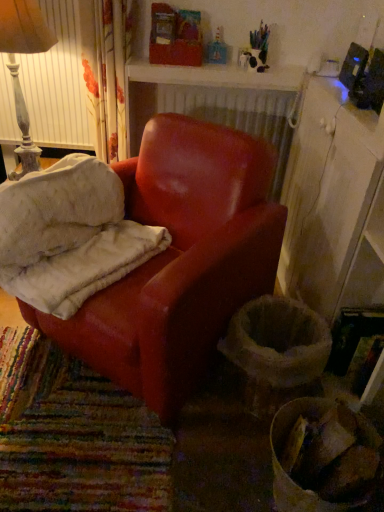
Describe the element at coordinates (18, 65) in the screenshot. I see `distressed white lampshade at upper left` at that location.

Describe the element at coordinates (69, 234) in the screenshot. Image resolution: width=384 pixels, height=512 pixels. I see `leather armchair at center` at that location.

Measure the distance between matte red armchair at center and camera.

matte red armchair at center is 1.10 meters away from camera.

Find the location of a particular element. white wood cabinet at right is located at coordinates (327, 193).

What do you see at coordinates (327, 193) in the screenshot?
I see `white wood cabinet at right` at bounding box center [327, 193].

Identify the location of distressed white lampshade at upper left. 18,65.

From a real-world perspective, which is physically below, white wood cabinet at right or matte red armchair at center?

In real-world perspective, matte red armchair at center is lower.

In the image, is white wood cabinet at right on the left side or the right side of matte red armchair at center?

In the image, white wood cabinet at right appears on the right side of matte red armchair at center.

Which object is wider, white wood cabinet at right or matte red armchair at center?

matte red armchair at center.

From the image's perspective, who appears lower, matte red armchair at center or distressed white lampshade at upper left?

matte red armchair at center is shown below in the image.

Where is `lamp on the left of matte red armchair at center`? lamp on the left of matte red armchair at center is located at coordinates (18, 65).

Which is less distant, (x=221, y=199) or (x=32, y=159)?

Positioned in front is point (x=221, y=199).

Is matte red armchair at center facing away from distressed white lampshade at upper left?

No, matte red armchair at center is not facing the opposite direction of distressed white lampshade at upper left.

You are a GUI agent. You are given a task and a screenshot of the screen. Output one action in this format:
    pyautogui.click(x=<x>, y=<y>)
    Task: Click on the cabinetry below the leather armchair at center (from a real-world perspective)
    This screenshot has width=384, height=512.
    Given the screenshot: What is the action you would take?
    pyautogui.click(x=327, y=193)

Is white wood cabinet at right further to the viewer compared to leather armchair at center?

Yes, it is behind leather armchair at center.

Can you tell me how much white wood cabinet at right and leather armchair at center differ in facing direction?

The angular difference between white wood cabinet at right and leather armchair at center is 50.6 degrees.

Measure the distance from white wood cabinet at right to leather armchair at center.

white wood cabinet at right and leather armchair at center are 31.16 inches apart from each other.

Based on the photo, is leather armchair at center further to the viewer compared to white textured radiator at upper center?

That is False.

From a real-world perspective, relative to white textured radiator at upper center, is leather armchair at center vertically above or below?

In terms of real-world spatial position, leather armchair at center is below white textured radiator at upper center.

Measure the distance between leather armchair at center and white textured radiator at upper center.

leather armchair at center and white textured radiator at upper center are 34.62 inches apart.

Between leather armchair at center and white textured radiator at upper center, which one has more height?

leather armchair at center is taller.

From the image's perspective, is white textured radiator at upper center located above white wood cabinet at right?

Yes, from the image's perspective, white textured radiator at upper center is on top of white wood cabinet at right.

Considering the relative positions of white textured radiator at upper center and white wood cabinet at right in the image provided, is white textured radiator at upper center to the left or to the right of white wood cabinet at right?

From the image, it's evident that white textured radiator at upper center is to the left of white wood cabinet at right.

From a real-world perspective, between white textured radiator at upper center and white wood cabinet at right, who is vertically lower?

white wood cabinet at right.

Can you confirm if distressed white lampshade at upper left is positioned to the left of white textured radiator at upper center?

Indeed, distressed white lampshade at upper left is positioned on the left side of white textured radiator at upper center.

From a real-world perspective, which object rests below the other?

white textured radiator at upper center, from a real-world perspective.

Does point (18, 109) come closer to viewer compared to point (284, 115)?

No, it is behind (284, 115).

Considering the relative positions of white textured radiator at upper center and matte red armchair at center in the image provided, is white textured radiator at upper center to the left or to the right of matte red armchair at center?

From the image, it's evident that white textured radiator at upper center is to the right of matte red armchair at center.

Considering the sizes of objects white textured radiator at upper center and matte red armchair at center in the image provided, who is bigger, white textured radiator at upper center or matte red armchair at center?

Bigger between the two is matte red armchair at center.

Between point (261, 106) and point (191, 170), which one is positioned in front?

Point (191, 170)

From a real-world perspective, who is located lower, white textured radiator at upper center or matte red armchair at center?

matte red armchair at center.

Where is `chair beneath the white wood cabinet at right (from a real-world perspective)`? chair beneath the white wood cabinet at right (from a real-world perspective) is located at coordinates (181, 260).

The height and width of the screenshot is (512, 384). I want to click on chair in front of the distressed white lampshade at upper left, so click(181, 260).

When comparing their distances from white wood cabinet at right, does distressed white lampshade at upper left or leather armchair at center seem closer?

leather armchair at center.

Based on their spatial positions, is white wood cabinet at right or distressed white lampshade at upper left further from white textured radiator at upper center?

Among the two, distressed white lampshade at upper left is located further to white textured radiator at upper center.

In the scene shown: Looking at the image, which one is located closer to white textured radiator at upper center, leather armchair at center or matte red armchair at center?

Based on the image, matte red armchair at center appears to be nearer to white textured radiator at upper center.

When comparing their distances from distressed white lampshade at upper left, does white wood cabinet at right or white textured radiator at upper center seem closer?

white textured radiator at upper center is positioned closer to the anchor distressed white lampshade at upper left.

When comparing their distances from matte red armchair at center, does white textured radiator at upper center or leather armchair at center seem closer?

leather armchair at center is positioned closer to the anchor matte red armchair at center.

When comparing their distances from white wood cabinet at right, does white textured radiator at upper center or matte red armchair at center seem closer?

The object closer to white wood cabinet at right is matte red armchair at center.

Considering their positions, is matte red armchair at center positioned further to white textured radiator at upper center than white wood cabinet at right?

matte red armchair at center lies further to white textured radiator at upper center than the other object.

From the image, which object appears to be nearer to distressed white lampshade at upper left, leather armchair at center or white textured radiator at upper center?

leather armchair at center.

You are a GUI agent. You are given a task and a screenshot of the screen. Output one action in this format:
    pyautogui.click(x=<x>, y=<y>)
    Task: Click on the chair between leather armchair at center and white wood cabinet at right from left to right
    The image size is (384, 512).
    Given the screenshot: What is the action you would take?
    [181, 260]

You are a GUI agent. You are given a task and a screenshot of the screen. Output one action in this format:
    pyautogui.click(x=<x>, y=<y>)
    Task: Click on the radiator between distressed white lampshade at upper left and white wood cabinet at right in the horizontal direction
    
    Given the screenshot: What is the action you would take?
    (237, 115)

Where is `lamp located between leather armchair at center and white textured radiator at upper center in the depth direction`? The width and height of the screenshot is (384, 512). lamp located between leather armchair at center and white textured radiator at upper center in the depth direction is located at coordinates (18, 65).

At what (x,y) coordinates should I click in order to perform the action: click on material between distressed white lampshade at upper left and matte red armchair at center vertically. Please return your answer as a coordinate pair (x, y). Looking at the image, I should click on (69, 234).